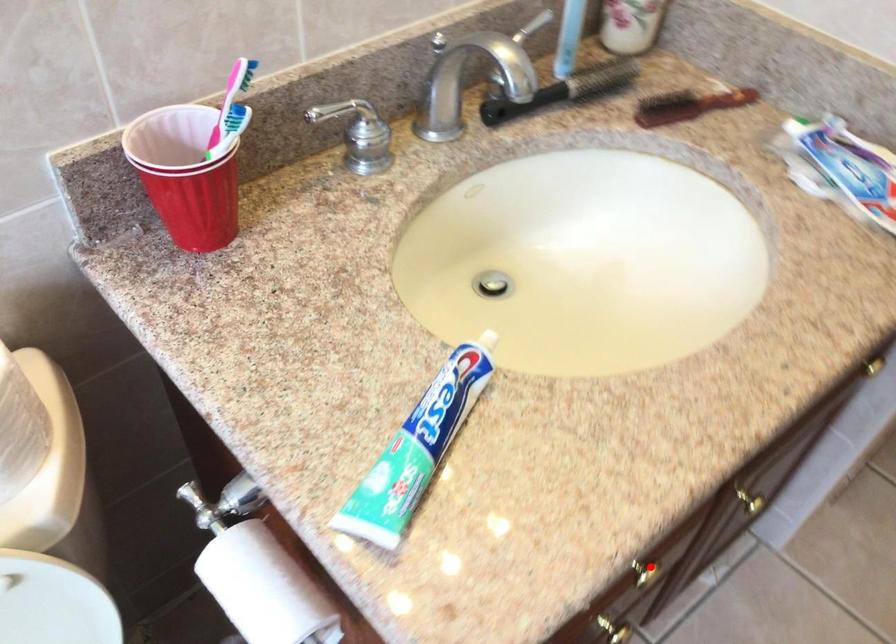
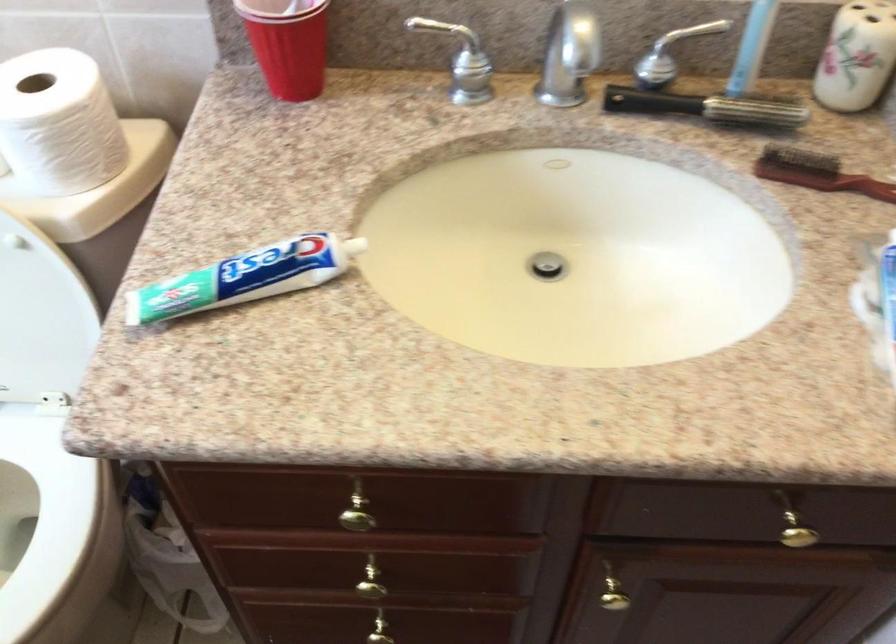
The point at the highlighted location is marked in the first image. Where is the corresponding point in the second image?

(358, 509)